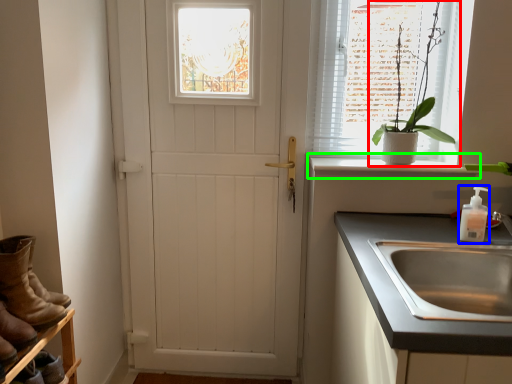
Question: Based on their relative distances, which object is nearer to houseplant (highlighted by a red box)? Choose from soap dispenser (highlighted by a blue box) and window sill (highlighted by a green box).

Choices:
 (A) soap dispenser
 (B) window sill

Answer: (B)